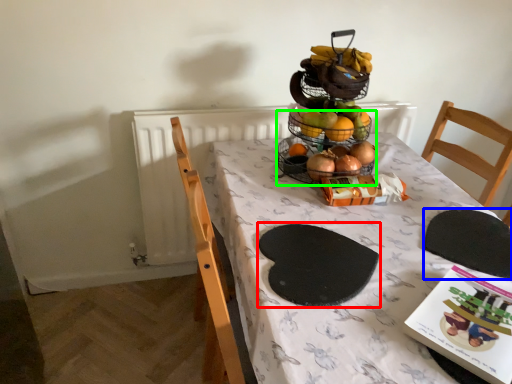
Question: Which object is positioned closest to mat (highlighted by a red box)? Select from mat (highlighted by a blue box) and basket (highlighted by a green box).

Choices:
 (A) mat
 (B) basket

Answer: (A)